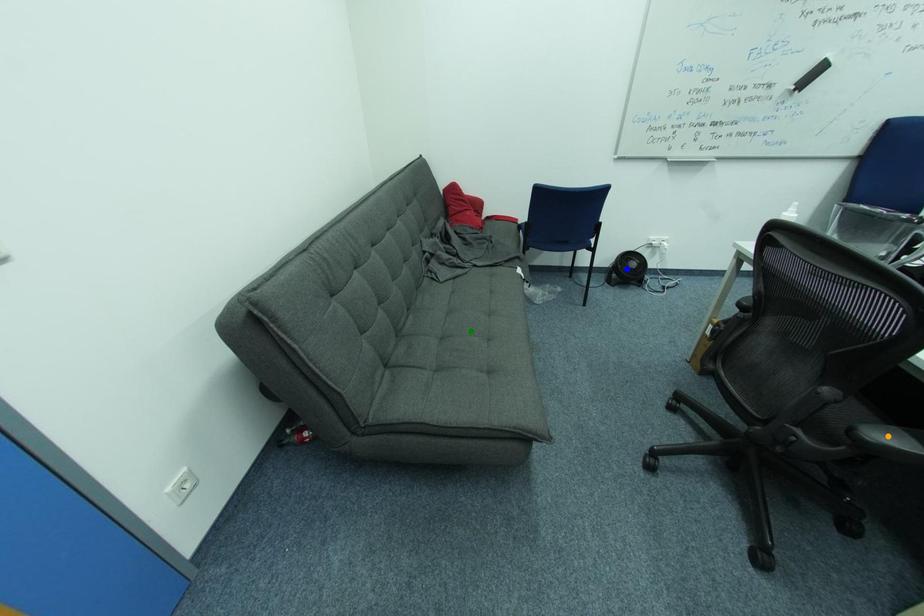
Order these from nearest to farthest:
- orange point
- blue point
- green point

orange point
green point
blue point